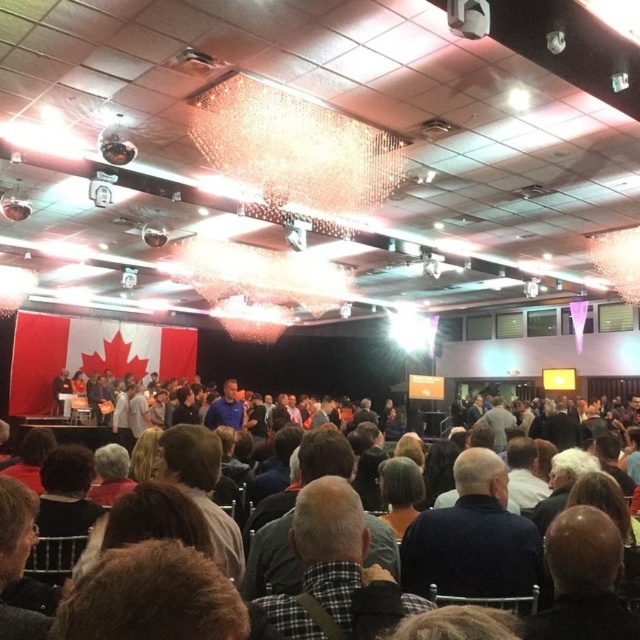
Question: Is dark gray fabric crowd at center below bald head at center?

Choices:
 (A) yes
 (B) no

Answer: (A)

Question: Estimate the real-world distances between objects in this image. Which object is farther from the dark gray fabric crowd at center?

Choices:
 (A) dark blue sweater at center
 (B) bald head at center

Answer: (B)

Question: Can you confirm if dark gray fabric crowd at center is bigger than bald head at center?

Choices:
 (A) yes
 (B) no

Answer: (A)

Question: Which of the following is the closest to the observer?

Choices:
 (A) (483, 593)
 (B) (557, 534)
 (C) (604, 602)

Answer: (C)

Question: Considering the relative positions of dark blue sweater at center and bald head at center in the image provided, where is dark blue sweater at center located with respect to bald head at center?

Choices:
 (A) right
 (B) left

Answer: (B)

Question: Estimate the real-world distances between objects in this image. Which object is farther from the bald head at center?

Choices:
 (A) dark blue sweater at center
 (B) dark gray fabric crowd at center

Answer: (A)